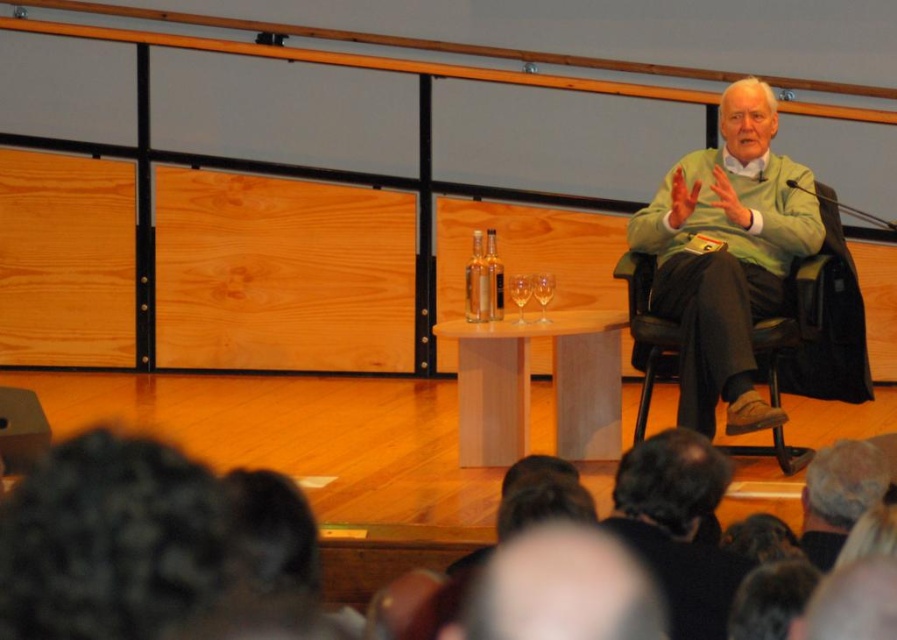
You are a stagehand who needs to adjust the lighting for the speaker. The transparent glass at center is part of a podium. Can you safely place a spotlight on the podium without it being too close to the green matte sweater at center?

The distance between the green matte sweater at center and the transparent glass at center is 79.86 centimeters. Since the spotlight would be placed on the podium, which is the transparent glass at center, and the sweater is part of the speaker, there is sufficient space to avoid the spotlight being too close.

In the scene shown: You are organizing a photoshoot and need to ensure that the green matte sweater at center and the clear glass wine glass at center are visible in the frame. Based on their sizes, which object might require more space in the composition?

The green matte sweater at center might be wider than the clear glass wine glass at center, so it might require more space in the composition.

You are a waiter at the event and need to place a new wine glass exactly where the clear glass wine glass at center is. What are the coordinates you should aim for?

The clear glass wine glass at center is located at coordinates point (519, 292), so you should aim for those coordinates to place the new wine glass there.